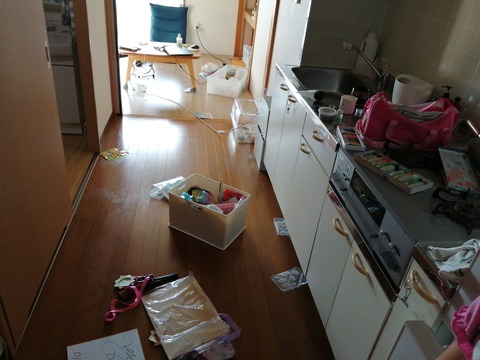
Find the location of a particular element. The width and height of the screenshot is (480, 360). cabinets handles knobs is located at coordinates (299, 148), (316, 138), (292, 100), (280, 86), (339, 229), (354, 264), (424, 294).